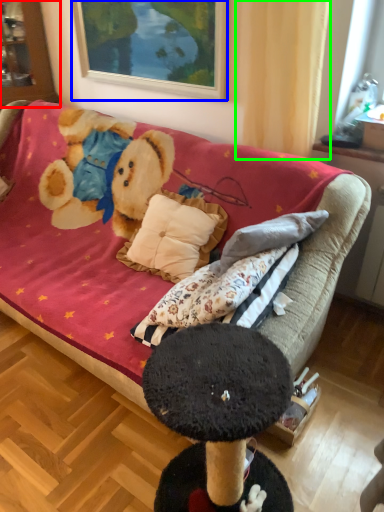
Question: Based on their relative distances, which object is nearer to cabinetry (highlighted by a red box)? Choose from picture frame (highlighted by a blue box) and curtain (highlighted by a green box).

Choices:
 (A) picture frame
 (B) curtain

Answer: (A)